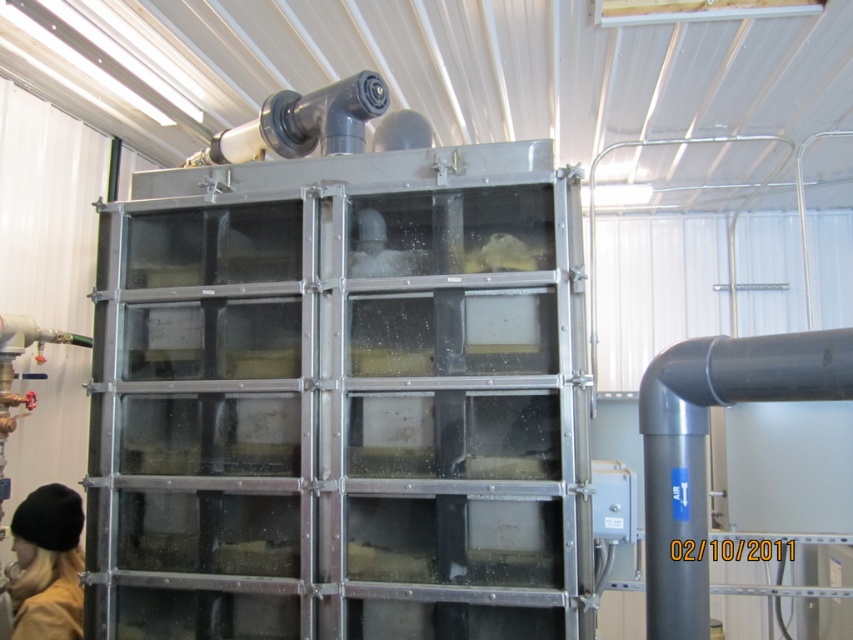
Between black knit hat at lower left and matte black pipe at upper center, which one is positioned lower?

black knit hat at lower left is lower down.

Is black knit hat at lower left closer to the viewer compared to matte black pipe at upper center?

Yes, black knit hat at lower left is closer to the viewer.

Is point (42, 579) positioned after point (376, 113)?

That is True.

I want to click on black knit hat at lower left, so [47, 564].